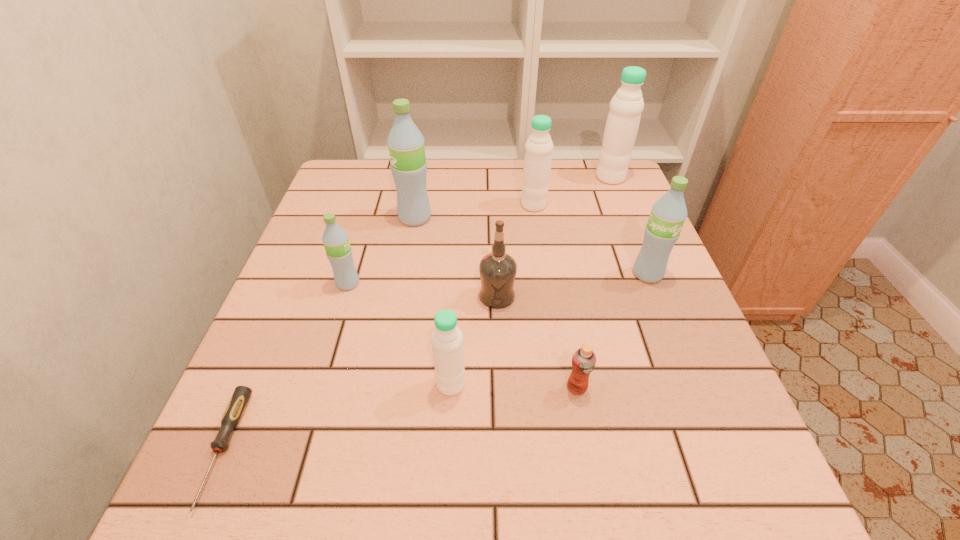
At what (x,y) coordinates should I click in order to perform the action: click on the farthest object. Please return your answer as a coordinate pair (x, y). The width and height of the screenshot is (960, 540). Looking at the image, I should click on click(x=626, y=106).

I want to click on the farthest water bottle, so click(626, 106).

Where is `the seventh object from right to left`? The height and width of the screenshot is (540, 960). the seventh object from right to left is located at coordinates (405, 142).

Locate an element on the screen. This screenshot has height=540, width=960. the biggest green water bottle is located at coordinates (405, 142).

This screenshot has height=540, width=960. I want to click on the fourth water bottle from left to right, so click(x=538, y=149).

Where is `the second nearest white water bottle`? Image resolution: width=960 pixels, height=540 pixels. the second nearest white water bottle is located at coordinates coord(538,149).

You are a GUI agent. You are given a task and a screenshot of the screen. Output one action in this format:
    pyautogui.click(x=<x>, y=<y>)
    Task: Click on the second smallest green water bottle
    The width and height of the screenshot is (960, 540).
    Given the screenshot: What is the action you would take?
    pyautogui.click(x=668, y=214)

Where is `vodka`? vodka is located at coordinates tap(497, 270).

The height and width of the screenshot is (540, 960). In order to click on the smallest green water bottle in this screenshot , I will do `click(335, 239)`.

Find the location of a particular element. The height and width of the screenshot is (540, 960). the leftmost water bottle is located at coordinates (335, 239).